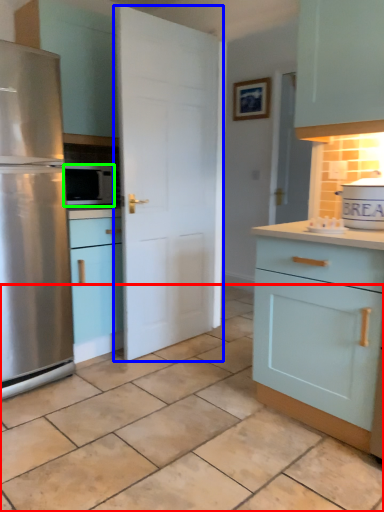
Question: Considering the real-world distances, which object is closest to tile (highlighted by a red box)? door (highlighted by a blue box) or microwave oven (highlighted by a green box).

Choices:
 (A) door
 (B) microwave oven

Answer: (A)